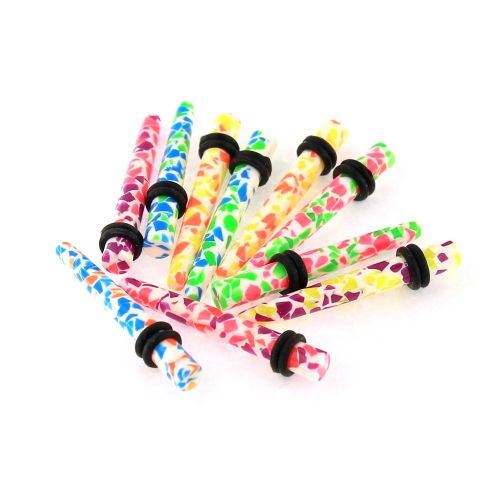
I want to click on purple and yellow plug, so pyautogui.click(x=326, y=290).